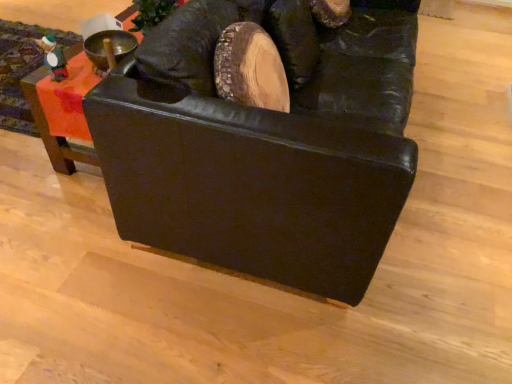
Question: Does black leather couch at center, the second furniture in the left-to-right sequence, have a smaller size compared to matte black couch at upper left, which ranks as the second furniture in right-to-left order?

Choices:
 (A) no
 (B) yes

Answer: (A)

Question: Considering the relative sizes of black leather couch at center, the second furniture in the left-to-right sequence, and matte black couch at upper left, the first furniture positioned from the left, in the image provided, is black leather couch at center, the second furniture in the left-to-right sequence, taller than matte black couch at upper left, the first furniture positioned from the left,?

Choices:
 (A) yes
 (B) no

Answer: (A)

Question: From a real-world perspective, is black leather couch at center, which is counted as the first furniture, starting from the right, below matte black couch at upper left, which ranks as the second furniture in right-to-left order?

Choices:
 (A) no
 (B) yes

Answer: (A)

Question: From the image's perspective, is black leather couch at center, which is counted as the first furniture, starting from the right, on matte black couch at upper left, the first furniture positioned from the left?

Choices:
 (A) no
 (B) yes

Answer: (A)

Question: From a real-world perspective, is black leather couch at center, which is counted as the first furniture, starting from the right, located higher than matte black couch at upper left, which ranks as the second furniture in right-to-left order?

Choices:
 (A) no
 (B) yes

Answer: (B)

Question: From the image's perspective, does black leather couch at center, which is counted as the first furniture, starting from the right, appear lower than matte black couch at upper left, which ranks as the second furniture in right-to-left order?

Choices:
 (A) yes
 (B) no

Answer: (A)

Question: From the image's perspective, is matte black couch at upper left, the first furniture positioned from the left, below black leather couch at center, which is counted as the first furniture, starting from the right?

Choices:
 (A) no
 (B) yes

Answer: (A)

Question: Can you confirm if matte black couch at upper left, the first furniture positioned from the left, is wider than black leather couch at center, which is counted as the first furniture, starting from the right?

Choices:
 (A) yes
 (B) no

Answer: (A)

Question: Can you confirm if matte black couch at upper left, which ranks as the second furniture in right-to-left order, is positioned to the right of black leather couch at center, the second furniture in the left-to-right sequence?

Choices:
 (A) yes
 (B) no

Answer: (B)

Question: Can you confirm if matte black couch at upper left, the first furniture positioned from the left, is taller than black leather couch at center, the second furniture in the left-to-right sequence?

Choices:
 (A) no
 (B) yes

Answer: (A)

Question: From a real-world perspective, is matte black couch at upper left, which ranks as the second furniture in right-to-left order, physically above black leather couch at center, which is counted as the first furniture, starting from the right?

Choices:
 (A) no
 (B) yes

Answer: (A)

Question: Is matte black couch at upper left, which ranks as the second furniture in right-to-left order, oriented towards black leather couch at center, which is counted as the first furniture, starting from the right?

Choices:
 (A) yes
 (B) no

Answer: (A)

Question: From the image's perspective, relative to black leather couch at center, the second furniture in the left-to-right sequence, is matte black couch at upper left, the first furniture positioned from the left, above or below?

Choices:
 (A) below
 (B) above

Answer: (B)